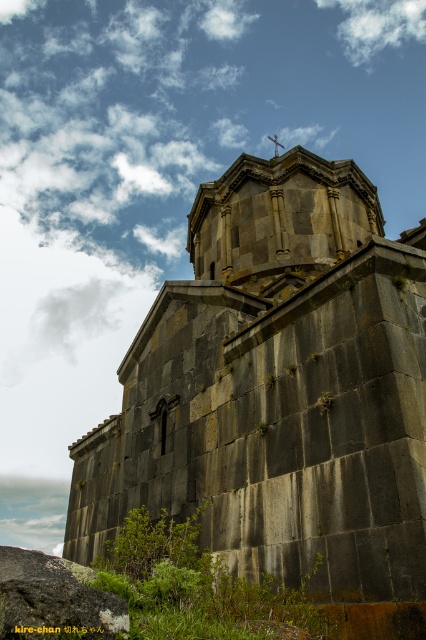
You are standing in front of the historic stone structure and notice two points marked on the building. The first point is at coordinates point (x=233, y=330) and the second is at point (x=360, y=51). Which of these points is closer to your current position?

The point at coordinates point (x=233, y=330) is closer to the camera than point (x=360, y=51), so it is closer to your current position.

You are standing in front of the historic stone structure depicted in the image. You notice a specific point marked at coordinates (279, 216). Can you identify which part of the structure this point corresponds to?

The point at coordinates (279, 216) corresponds to the dark gray stone tower at upper center of the structure.

You are standing in front of the historic stone structure and want to take a photo of the gray rough rock at lower left and the white fluffy cloud at upper center. Which object is closer to the ground?

The gray rough rock at lower left is positioned under the white fluffy cloud at upper center, so it is closer to the ground.